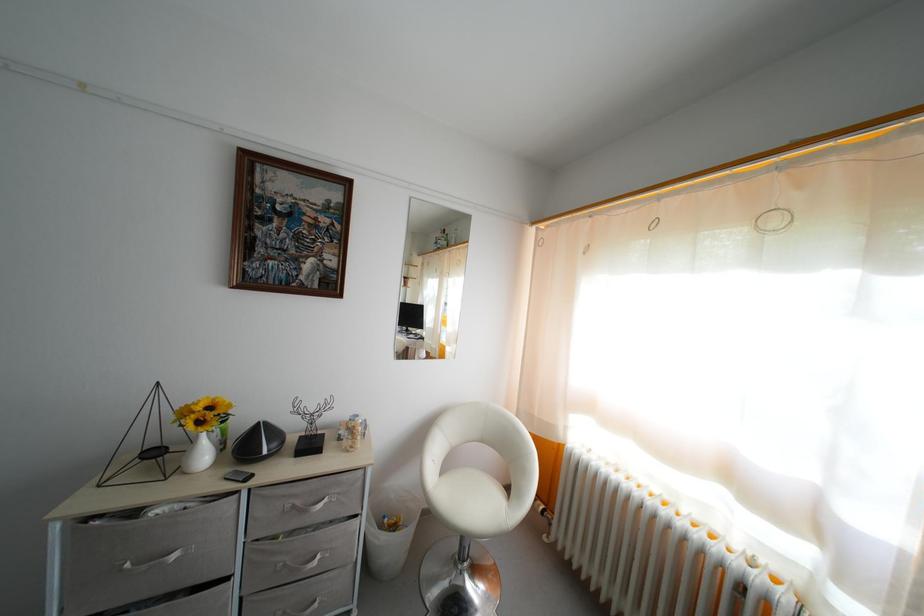
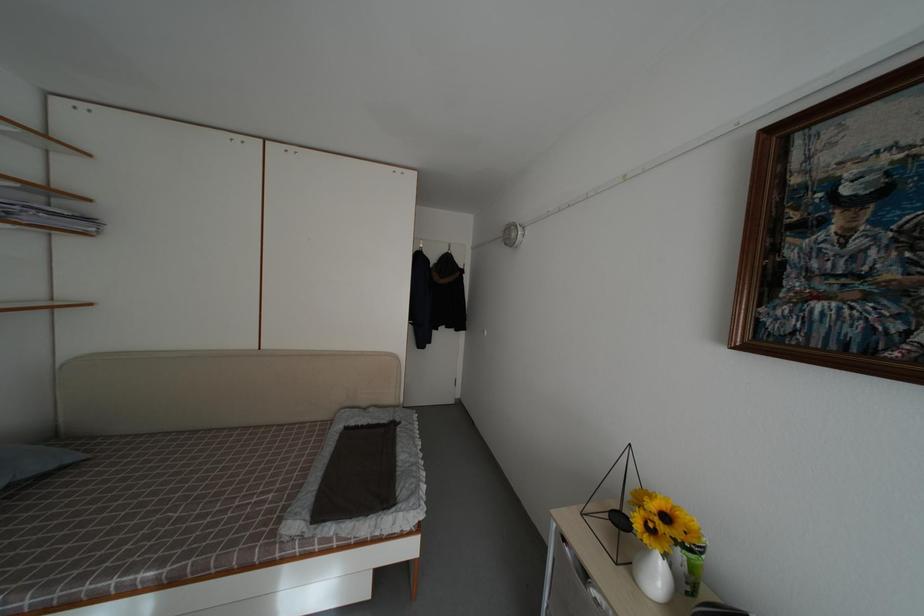
Locate, in the second image, the point that corresponds to [210,462] in the first image.

(664, 584)